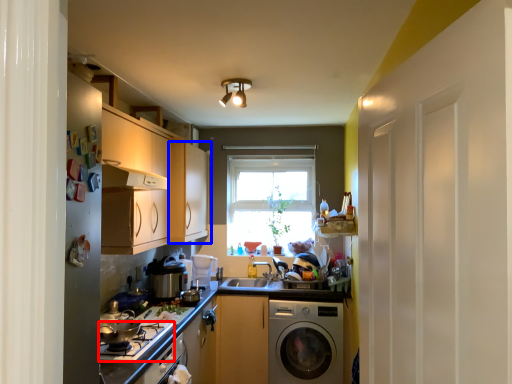
Question: Among these objects, which one is nearest to the camera, gas stove (highlighted by a red box) or cabinetry (highlighted by a blue box)?

Choices:
 (A) gas stove
 (B) cabinetry

Answer: (A)